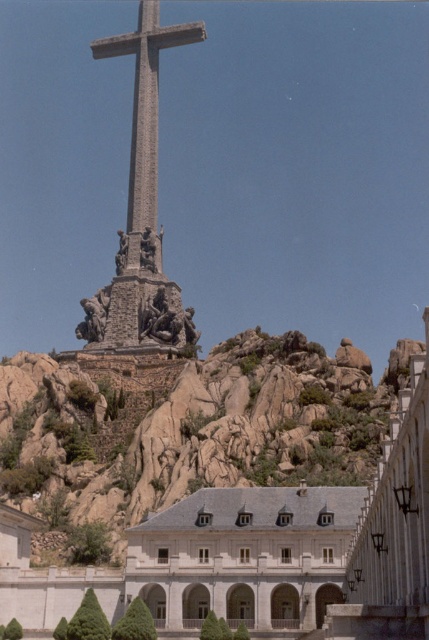
Is white stone building at lower left positioned at the back of stone cross at center?

No, it is not.

In the scene shown: Which is more to the right, white stone building at lower left or stone cross at center?

Positioned to the right is white stone building at lower left.

The width and height of the screenshot is (429, 640). I want to click on white stone building at lower left, so click(x=250, y=513).